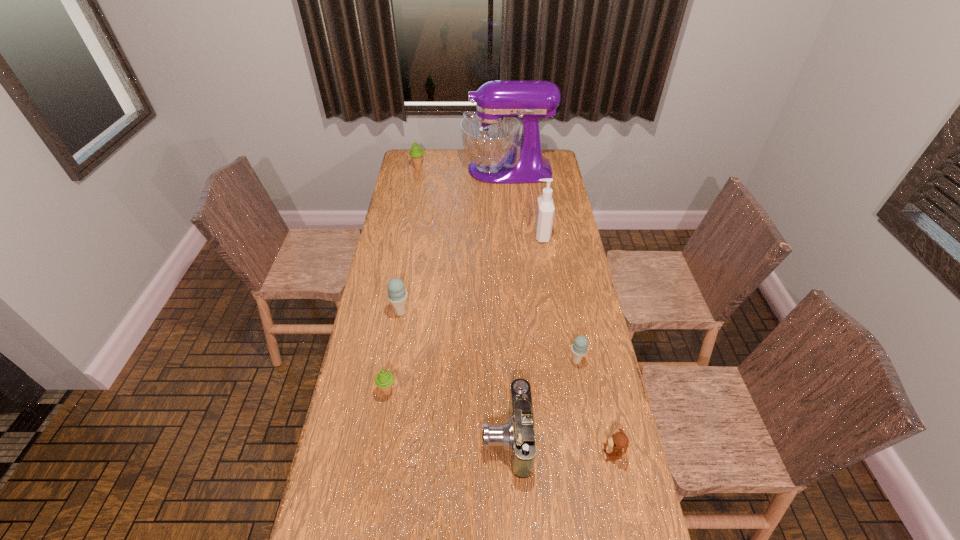
This screenshot has width=960, height=540. In the image, there is a desktop. Identify the location of vacant space at the right edge. (594, 455).

Find the location of a particular element. The image size is (960, 540). vacant space in between the smaller blue ice cream and the teddy bear is located at coordinates (594, 407).

Where is `blank region between the left blue ice cream and the rightmost ice cream`? The image size is (960, 540). blank region between the left blue ice cream and the rightmost ice cream is located at coordinates (489, 336).

Locate an element on the screen. free space between the teddy bear and the purple mixer is located at coordinates (560, 311).

Identify the location of free spot between the smaller blue ice cream and the cleansing agent. The width and height of the screenshot is (960, 540). (559, 298).

The width and height of the screenshot is (960, 540). I want to click on vacant point located between the mixer and the farthest ice cream, so (463, 169).

This screenshot has height=540, width=960. Find the location of `free space between the farthest ice cream and the mixer`. free space between the farthest ice cream and the mixer is located at coordinates (463, 169).

Where is `vacant space that is in between the mixer and the shortest object`? vacant space that is in between the mixer and the shortest object is located at coordinates (560, 311).

Identify the location of empty space that is in between the blue camcorder and the third farthest ice cream. (541, 399).

Identify the location of free space between the farthest ice cream and the sixth nearest object. The image size is (960, 540). (480, 201).